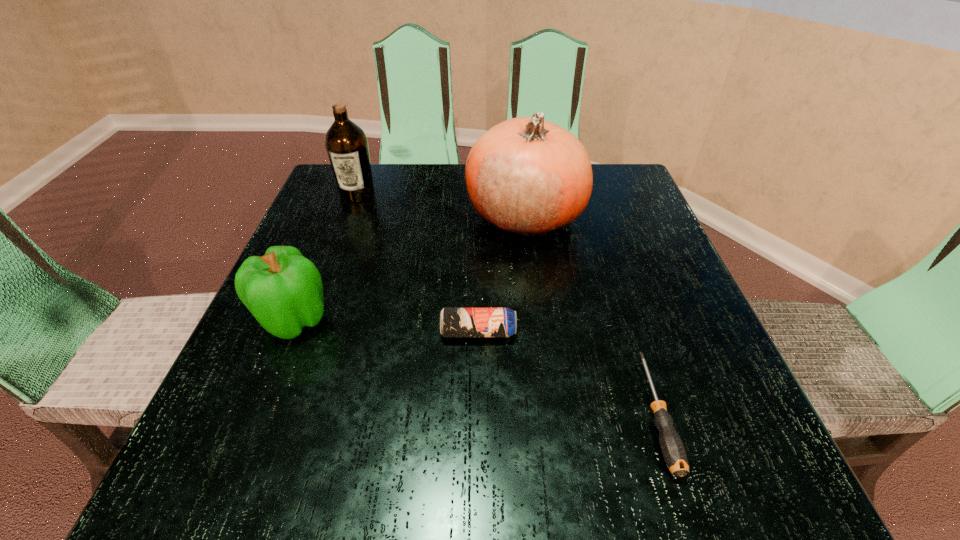
Identify the location of vacant region that satisfies the following two spatial constraints: 1. on the label of the second shortest object; 2. on the right side of the olive oil. (306, 332).

You are a GUI agent. You are given a task and a screenshot of the screen. Output one action in this format:
    pyautogui.click(x=<x>, y=<y>)
    Task: Click on the free location that satisfies the following two spatial constraints: 1. on the label of the olive oil; 2. on the left side of the shortest object
    The height and width of the screenshot is (540, 960).
    Given the screenshot: What is the action you would take?
    pyautogui.click(x=276, y=413)

This screenshot has height=540, width=960. Identify the location of free space that satisfies the following two spatial constraints: 1. on the label of the olive oil; 2. on the right side of the pumpkin. (350, 214).

The height and width of the screenshot is (540, 960). What are the coordinates of `vacant region that satisfies the following two spatial constraints: 1. on the label of the second shortest object; 2. on the left side of the olive oil` in the screenshot? It's located at (306, 332).

The height and width of the screenshot is (540, 960). In order to click on free space in the image that satisfies the following two spatial constraints: 1. on the front side of the screwdriver; 2. on the left side of the bell pepper in this screenshot , I will do `click(255, 413)`.

The height and width of the screenshot is (540, 960). Identify the location of free space that satisfies the following two spatial constraints: 1. on the front side of the pumpkin; 2. on the right side of the screwdriver. (549, 413).